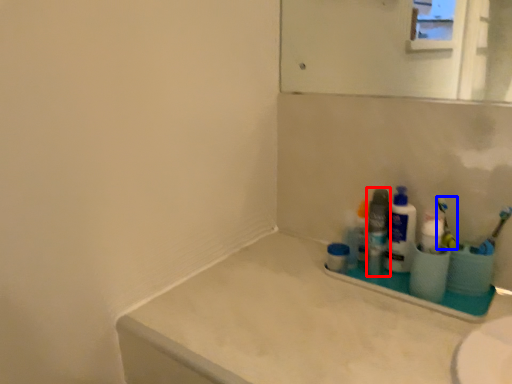
Question: Which object is further to the camera taking this photo, toiletry (highlighted by a red box) or toothbrush (highlighted by a blue box)?

Choices:
 (A) toiletry
 (B) toothbrush

Answer: (A)